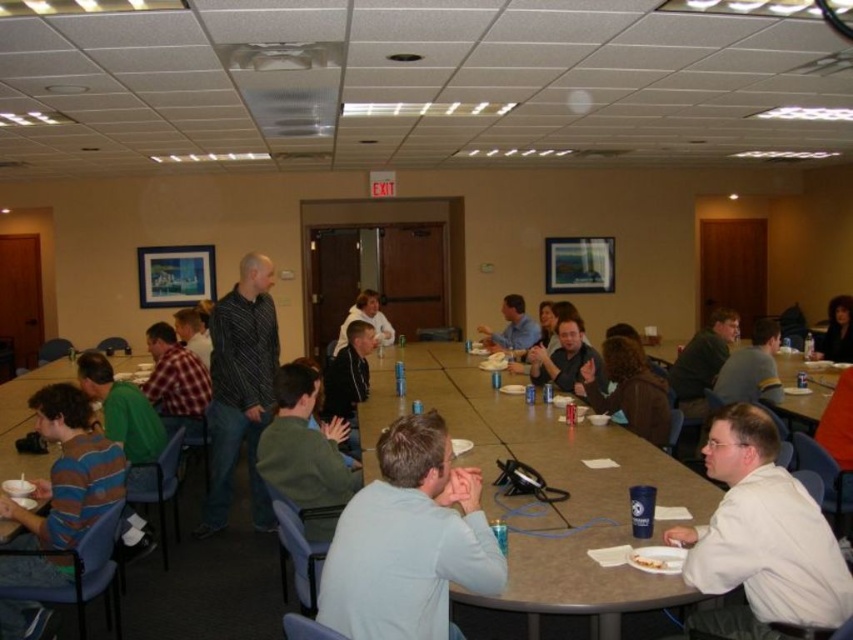
Question: Which object is the farthest from the smooth plastic table at center?

Choices:
 (A) green fabric shirt at center
 (B) light blue shirt at center
 (C) green fabric jacket at center
 (D) dark brown hair at upper right

Answer: (D)

Question: Which of the following is the closest to the observer?

Choices:
 (A) plaid shirt at center
 (B) dark brown hair at upper right
 (C) striped cotton shirt at lower left

Answer: (C)

Question: Does dark brown hair at center have a lesser width compared to dark gray shirt at center?

Choices:
 (A) no
 (B) yes

Answer: (A)

Question: Which object is the closest to the green fabric jacket at center?

Choices:
 (A) light blue fabric shirt at center
 (B) dark gray shirt at center
 (C) light brown hair at center

Answer: (B)

Question: Is white matte shirt at lower right in front of green fabric shirt at center?

Choices:
 (A) yes
 (B) no

Answer: (A)

Question: Does matte black shirt at center have a larger size compared to white paper plate at lower center?

Choices:
 (A) no
 (B) yes

Answer: (B)